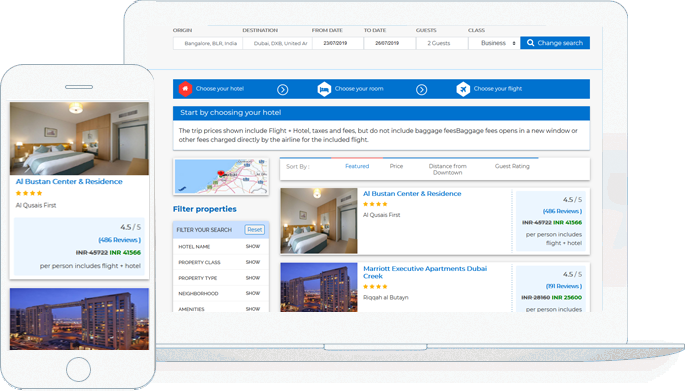
What are the coordinates of `bright ceiling lights` in the screenshot? It's located at (315, 193), (71, 106).